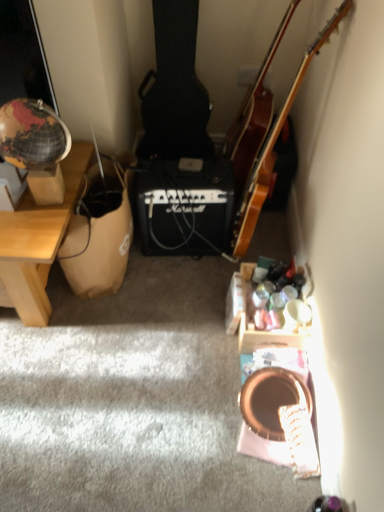
Where is `free space to the right of wooden desk at left`? The height and width of the screenshot is (512, 384). free space to the right of wooden desk at left is located at coordinates (168, 312).